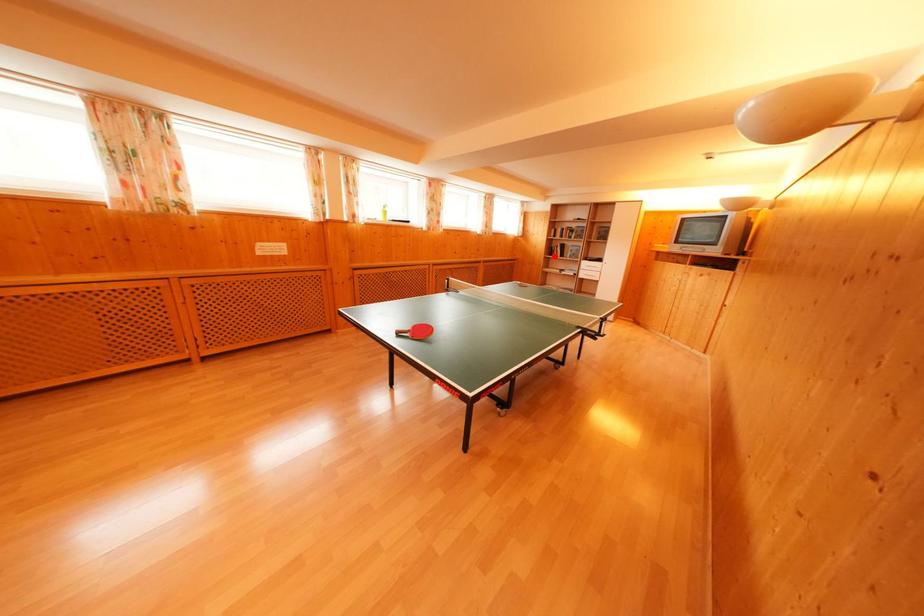
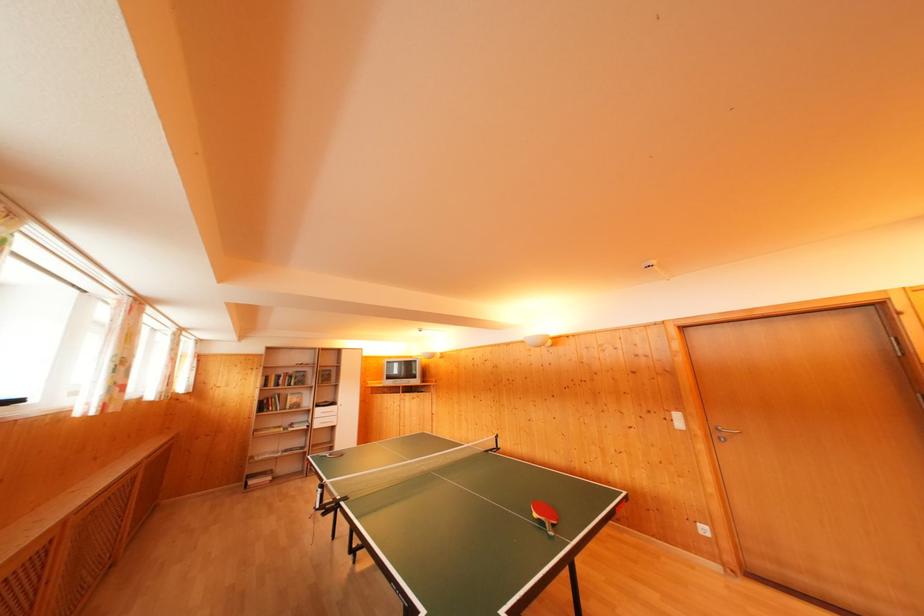
Question: I am providing you with two images of the same scene from different viewpoints. Image1 has a red point marked. In image2, the corresponding 3D location appears at what relative position? Reply with the corresponding letter.

Choices:
 (A) Closer
 (B) Farther

Answer: (B)